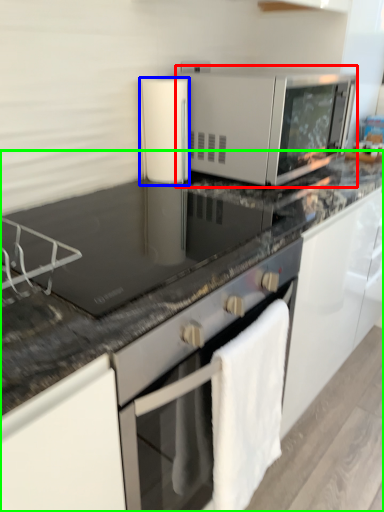
Question: Considering the real-world distances, which object is closest to microwave oven (highlighted by a red box)? appliance (highlighted by a blue box) or countertop (highlighted by a green box).

Choices:
 (A) appliance
 (B) countertop

Answer: (A)